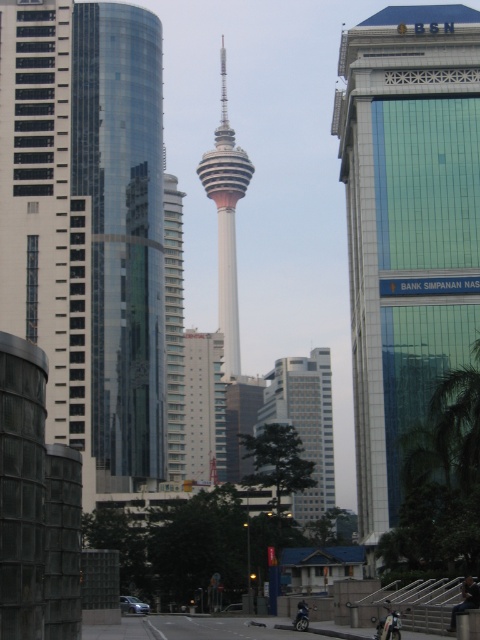
Can you confirm if green glass building at center is taller than shiny chrome motorcycle at center?

Yes.

The width and height of the screenshot is (480, 640). What do you see at coordinates (407, 225) in the screenshot?
I see `green glass building at center` at bounding box center [407, 225].

This screenshot has width=480, height=640. I want to click on green glass building at center, so click(407, 225).

Is white glass building at center to the right of white smooth tower at center from the viewer's perspective?

Yes, white glass building at center is to the right of white smooth tower at center.

Measure the distance between white glass building at center and white smooth tower at center.

white glass building at center is 22.77 meters from white smooth tower at center.

Which is in front, point (284, 374) or point (204, 154)?

Point (284, 374)

Identify the location of white glass building at center. (304, 422).

Which is more to the right, green glass building at center or transparent glass tower at center?

green glass building at center

Is point (402, 280) more distant than point (141, 22)?

No, (402, 280) is closer to viewer.

I want to click on green glass building at center, so click(407, 225).